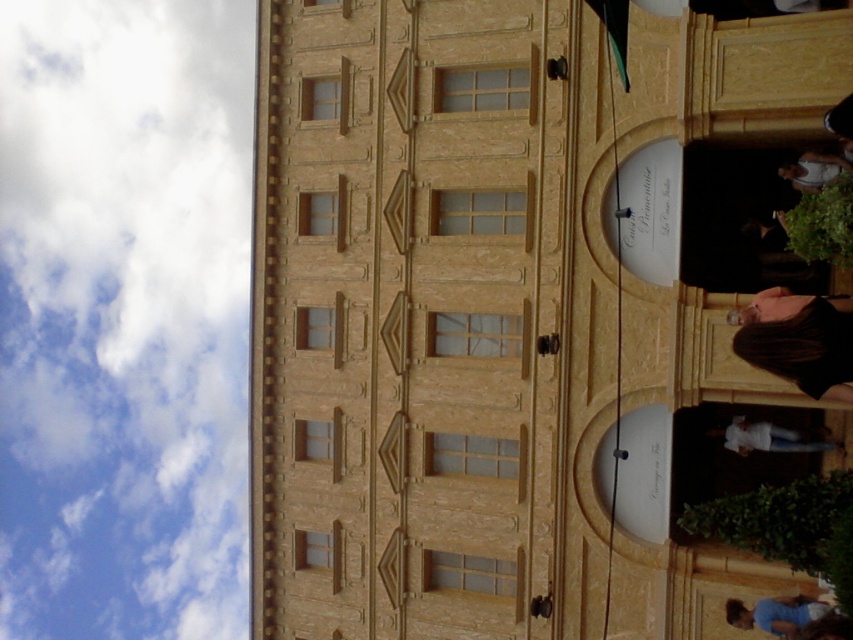
You are standing in front of the classical building and notice a point marked at coordinates (x=125, y=317). What object is located at that point?

The point at coordinates (x=125, y=317) marks a white fluffy cloud at upper left.

Based on the photo, you are standing in front of the classical building and notice two figures in the scene. The first is a person with brown hair at right, and the second is a blue fabric skateboarder at lower right. Which figure appears taller in the image?

The brown hair at right appears taller than the blue fabric skateboarder at lower right in the image.